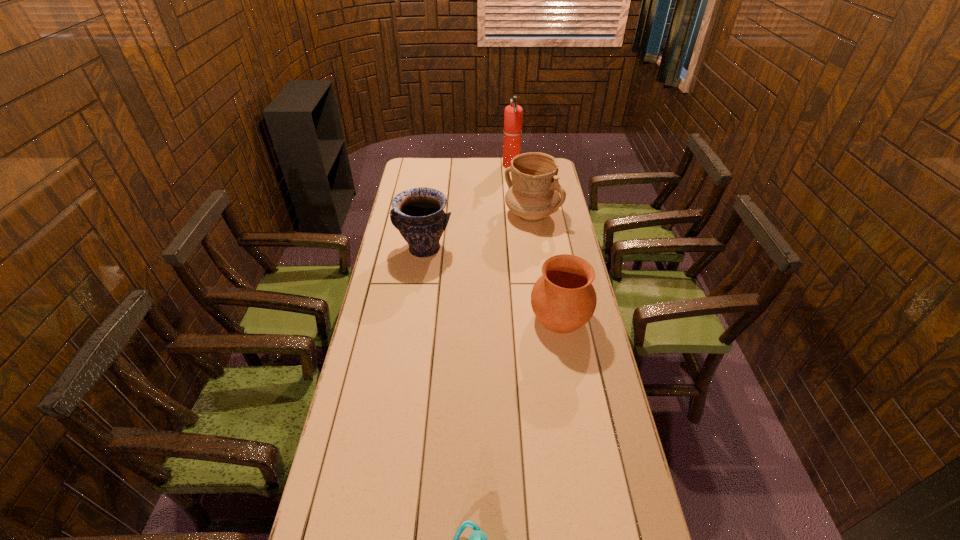
Locate an element on the screen. free spot between the fourth nearest object and the leftmost object is located at coordinates (478, 232).

Locate an element on the screen. object identified as the third closest to the fourth object from right to left is located at coordinates (533, 194).

Select which object is the third closest to the third nearest object. Please provide its 2D coordinates. Your answer should be formatted as a tuple, i.e. [(x, y)], where the tuple contains the x and y coordinates of a point satisfying the conditions above.

[(513, 114)]

At what (x,y) coordinates should I click in order to perform the action: click on pottery that stands as the second closest to the tallest object. Please return your answer as a coordinate pair (x, y). This screenshot has width=960, height=540. Looking at the image, I should click on (417, 213).

Select which pottery appears as the closest to the farthest pottery. Please provide its 2D coordinates. Your answer should be formatted as a tuple, i.e. [(x, y)], where the tuple contains the x and y coordinates of a point satisfying the conditions above.

[(417, 213)]

You are a GUI agent. You are given a task and a screenshot of the screen. Output one action in this format:
    pyautogui.click(x=<x>, y=<y>)
    Task: Click on the vacant region that satisfies the following two spatial constraints: 1. on the back side of the fourth farthest object; 2. with the nozzle and gauge on the tallest object
    This screenshot has height=540, width=960.
    Given the screenshot: What is the action you would take?
    pyautogui.click(x=533, y=166)

At what (x,y) coordinates should I click in order to perform the action: click on free spot that satisfies the following two spatial constraints: 1. with the nozzle and gauge on the fire extinguisher; 2. on the right side of the farthest pottery. Please return your answer as a coordinate pair (x, y). This screenshot has width=960, height=540. Looking at the image, I should click on (516, 214).

Where is `free space that satisfies the following two spatial constraints: 1. with the nozzle and gauge on the tallest object; 2. on the back side of the nearest pottery`? free space that satisfies the following two spatial constraints: 1. with the nozzle and gauge on the tallest object; 2. on the back side of the nearest pottery is located at coordinates (527, 318).

Image resolution: width=960 pixels, height=540 pixels. What are the coordinates of `free space that satisfies the following two spatial constraints: 1. with the nozzle and gauge on the farthest object; 2. on the right side of the second nearest object` in the screenshot? It's located at (527, 318).

At what (x,y) coordinates should I click in order to perform the action: click on free space in the image that satisfies the following two spatial constraints: 1. with the nozzle and gauge on the fire extinguisher; 2. on the left side of the farthest pottery. Please return your answer as a coordinate pair (x, y). Looking at the image, I should click on (516, 214).